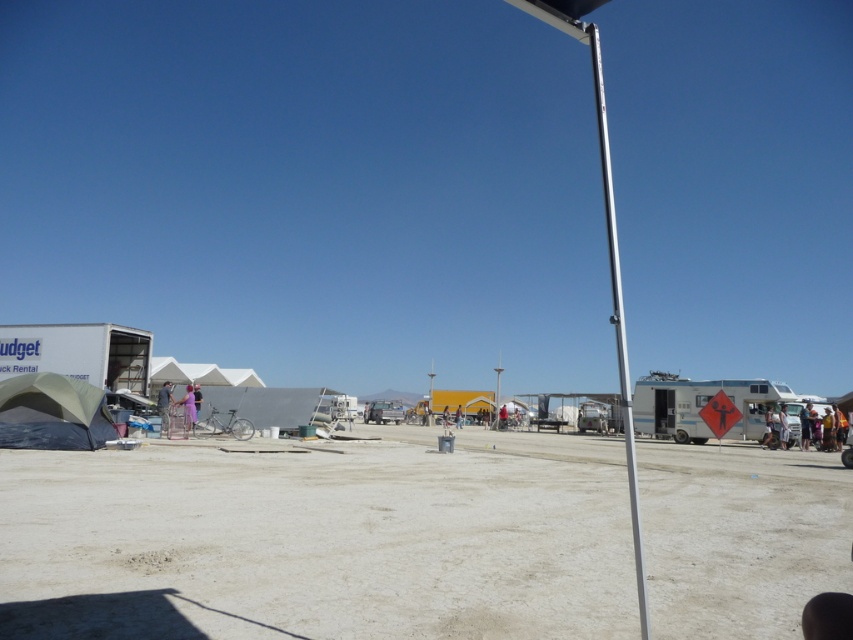
You are standing at the center of the image and want to pick up the denim jacket at lower left. In which direction should you move relative to the image frame?

The denim jacket at lower left is located at point 0.634 on the x axis and 0.193 on the y axis. Since you are at the center, you should move towards the lower right direction to reach it.

You are setting up a tent in the desert and have a matte gray tent at lower left and a silver metallic pole at center. Which object is shorter?

The matte gray tent at lower left is shorter than the silver metallic pole at center.

You are standing at the entrance of the campsite and see the denim jacket at lower left and the light blue fabric at center. Which object is closer to your left side?

The denim jacket at lower left is closer to your left side because it is positioned to the left of the light blue fabric at center.